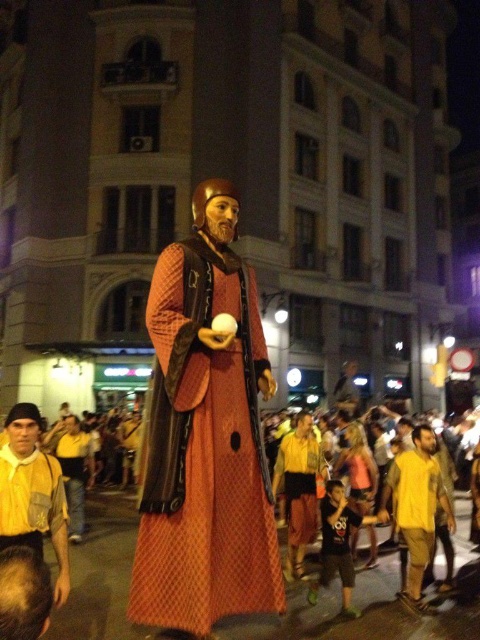
You are standing at the camera position and want to throw a small ball to the yellow fabric shirt at lower left. The ball can travel 35 feet. Will it reach the target?

The yellow fabric shirt at lower left is 40.80 feet away from the camera, so the ball cannot reach it since it can only travel 35 feet.

You are organizing a costume party and need to choose between the yellow fabric shirt at lower left and the yellow cotton shirt at center for a character who requires a wider shirt. Based on the image, which shirt should you select?

The yellow cotton shirt at center is wider than the yellow fabric shirt at lower left, so you should select the yellow cotton shirt at center for the character who requires a wider shirt.

In the scene shown: You are a photographer trying to capture the orange fabric figure at center and the yellow fabric shirt at lower left in the same frame. Based on their positions, which object is closer to the camera?

The orange fabric figure at center is closer to the camera because it is positioned over the yellow fabric shirt at lower left, indicating it is in front.